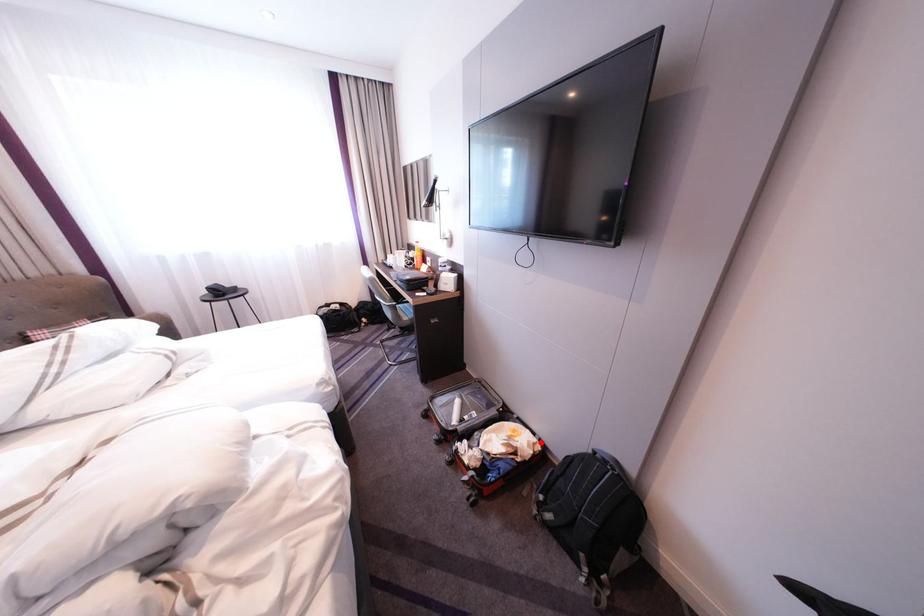
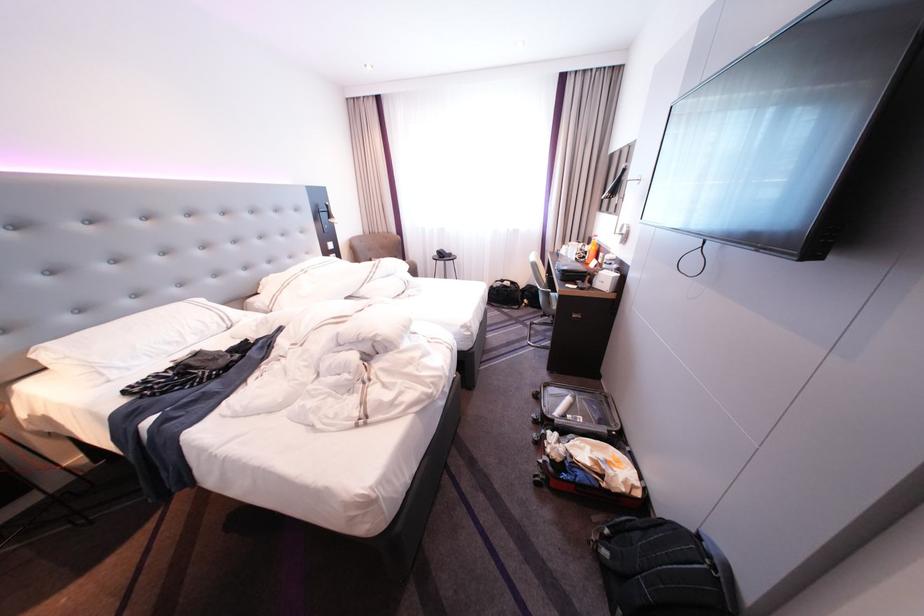
Find the pixel in the second image that matches the highlighted location in the first image.

(639, 480)